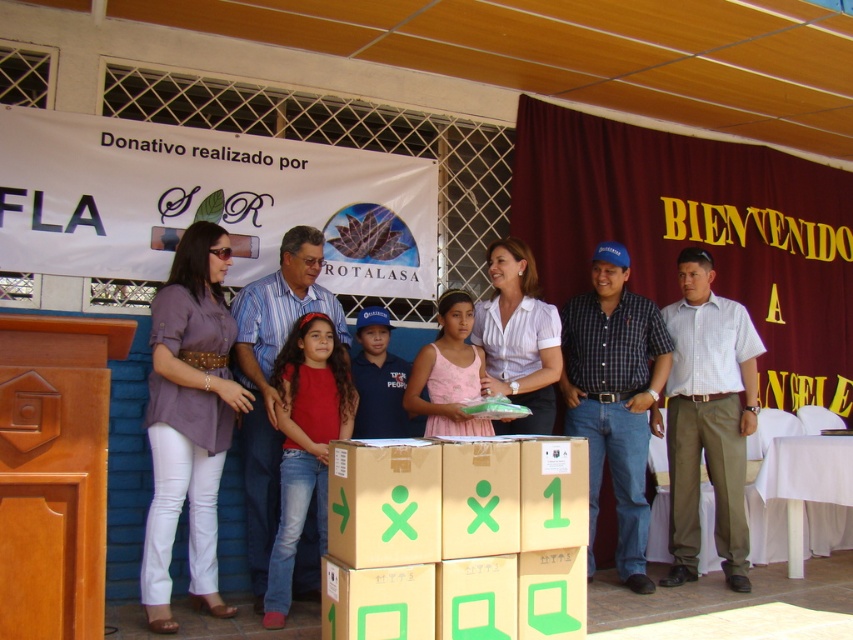
Question: Estimate the real-world distances between objects in this image. Which object is farther from the white checkered shirt at right?

Choices:
 (A) brown cardboard box at center
 (B) blue denim jeans at center

Answer: (B)

Question: Which point is closer to the camera taking this photo?

Choices:
 (A) pos(737,424)
 (B) pos(480,616)
 (C) pos(659,312)

Answer: (B)

Question: Which object is farther from the camera taking this photo?

Choices:
 (A) blue denim jeans at center
 (B) blue plaid shirt at center
 (C) white checkered shirt at right

Answer: (C)

Question: Does brown cardboard box at center appear over blue plaid shirt at center?

Choices:
 (A) no
 (B) yes

Answer: (A)

Question: Does brown cardboard box at center have a lesser width compared to blue plaid shirt at center?

Choices:
 (A) yes
 (B) no

Answer: (B)

Question: Considering the relative positions of blue plaid shirt at center and blue denim jeans at center in the image provided, where is blue plaid shirt at center located with respect to blue denim jeans at center?

Choices:
 (A) above
 (B) below

Answer: (B)